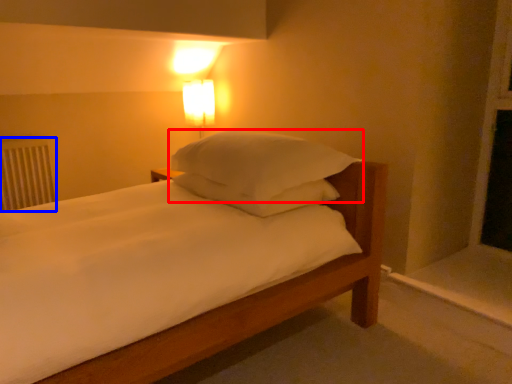
Question: Which point is further to the camera, pillow (highlighted by a red box) or radiator (highlighted by a blue box)?

Choices:
 (A) pillow
 (B) radiator

Answer: (B)